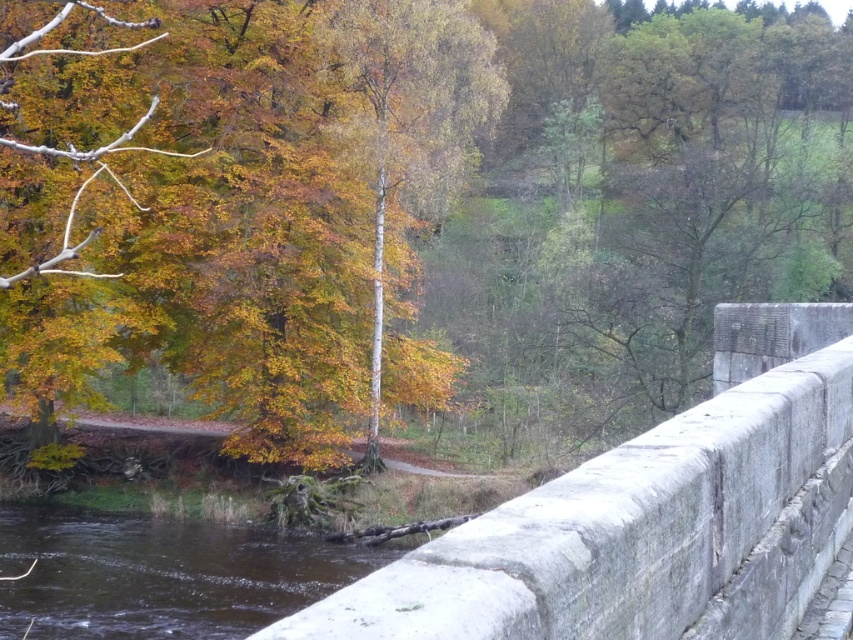
You are standing on a stone bridge and want to cross to the other side. The gray stone bridge at center is 7.33 feet from you. Can you safely walk across it?

The gray stone bridge at center is 7.33 feet from you, so yes, you can safely walk across it since the distance is manageable for crossing.

In the scene shown: You are standing on the gray stone bridge at center. Looking down, you notice a point marked at coordinates (651,515). Can you determine what object is located exactly at that point?

The point at coordinates (651,515) is where the gray stone bridge at center is located.